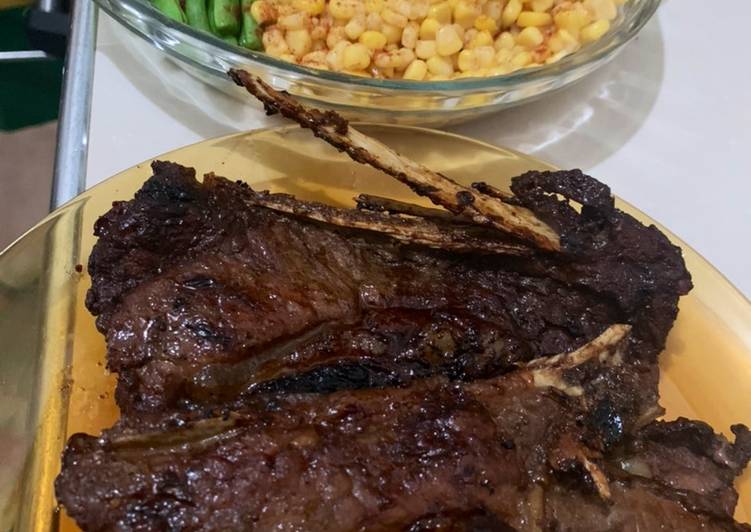
Identify the location of edge of counter. coord(71,152).